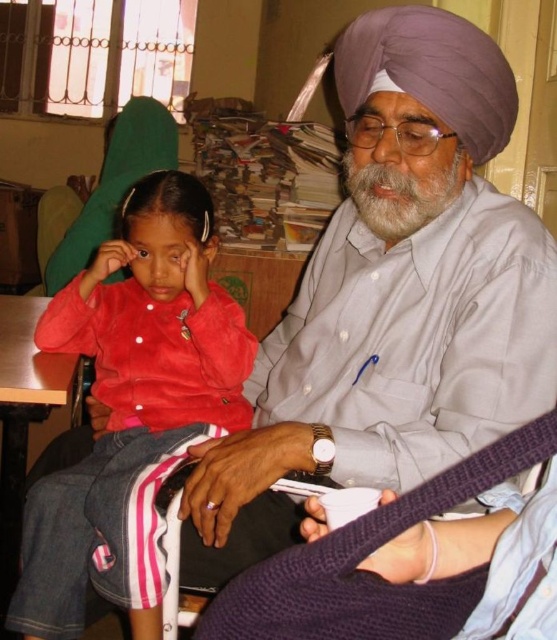
Question: Can you confirm if matte red shirt at left is positioned above purple silk turban at upper center?

Choices:
 (A) no
 (B) yes

Answer: (A)

Question: Which point appears farthest from the camera in this image?

Choices:
 (A) (70, 346)
 (B) (388, 10)

Answer: (A)

Question: Is matte red shirt at left smaller than purple silk turban at upper center?

Choices:
 (A) yes
 (B) no

Answer: (B)

Question: Does matte red shirt at left have a greater width compared to purple silk turban at upper center?

Choices:
 (A) no
 (B) yes

Answer: (B)

Question: Which point is closer to the camera taking this photo?

Choices:
 (A) (95, 330)
 (B) (437, 61)

Answer: (B)